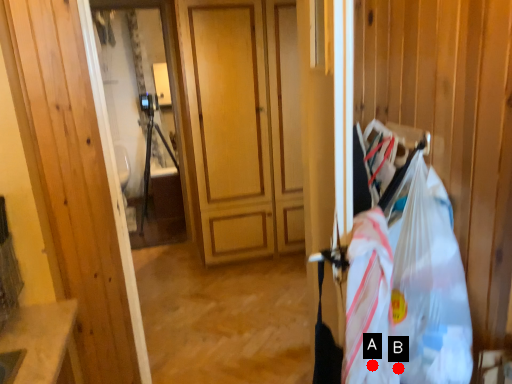
Question: Two points are circled on the image, labeled by A and B beside each circle. Which point is further to the camera?

Choices:
 (A) A is further
 (B) B is further

Answer: (A)